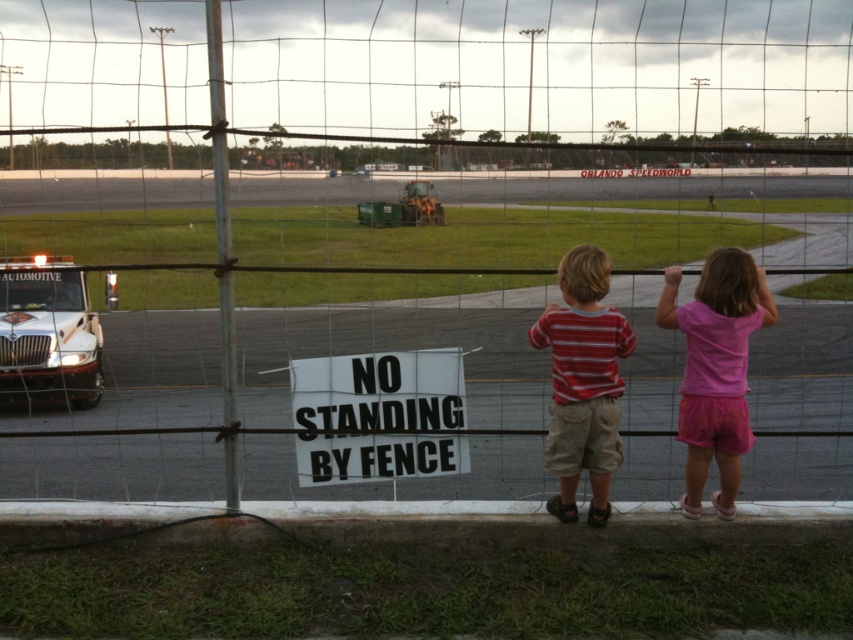
Question: Which point appears farthest from the camera in this image?

Choices:
 (A) (596, 419)
 (B) (33, 374)

Answer: (B)

Question: Based on their relative distances, which object is farther from the pink fabric shorts at center?

Choices:
 (A) white glossy truck at left
 (B) striped cotton shirt at center
 (C) white paper sign at center

Answer: (A)

Question: Is white paper sign at center positioned before white glossy truck at left?

Choices:
 (A) no
 (B) yes

Answer: (B)

Question: Among these points, which one is nearest to the camera?

Choices:
 (A) (30, 371)
 (B) (312, 419)
 (C) (592, 442)

Answer: (C)

Question: Can you confirm if pink fabric shorts at center is positioned to the right of white glossy truck at left?

Choices:
 (A) no
 (B) yes

Answer: (B)

Question: Is white paper sign at center below striped cotton shirt at center?

Choices:
 (A) no
 (B) yes

Answer: (B)